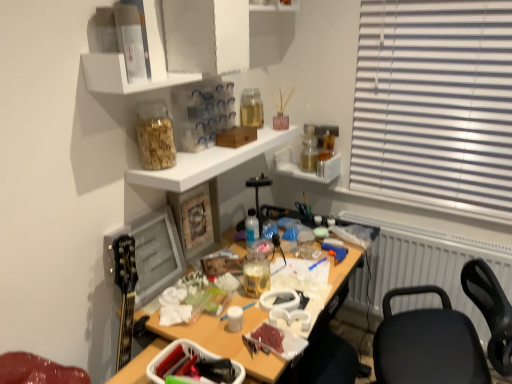
Question: Is white glossy shelf at upper center, which is the second shelf in bottom-to-top order, not within clear plastic container at upper center, arranged as the first shelf when viewed from the top?

Choices:
 (A) no
 (B) yes

Answer: (B)

Question: From a real-world perspective, is white glossy shelf at upper center, the 3th shelf when ordered from top to bottom, located higher than clear plastic container at upper center, arranged as the first shelf when viewed from the top?

Choices:
 (A) no
 (B) yes

Answer: (A)

Question: Is white glossy shelf at upper center, the 3th shelf when ordered from top to bottom, bigger than clear plastic container at upper center, arranged as the first shelf when viewed from the top?

Choices:
 (A) no
 (B) yes

Answer: (B)

Question: Can you confirm if white glossy shelf at upper center, the 3th shelf when ordered from top to bottom, is wider than clear plastic container at upper center, arranged as the first shelf when viewed from the top?

Choices:
 (A) yes
 (B) no

Answer: (A)

Question: Can you confirm if white glossy shelf at upper center, the 3th shelf when ordered from top to bottom, is thinner than clear plastic container at upper center, the 4th shelf from the bottom?

Choices:
 (A) yes
 (B) no

Answer: (B)

Question: From a real-world perspective, is white plastic radiator at right positioned above or below clear plastic container at upper center, the 4th shelf from the bottom?

Choices:
 (A) above
 (B) below

Answer: (B)

Question: From the image's perspective, is white plastic radiator at right above or below clear plastic container at upper center, the 4th shelf from the bottom?

Choices:
 (A) below
 (B) above

Answer: (A)

Question: Considering the positions of white plastic radiator at right and clear plastic container at upper center, arranged as the first shelf when viewed from the top, in the image, is white plastic radiator at right taller or shorter than clear plastic container at upper center, arranged as the first shelf when viewed from the top,?

Choices:
 (A) tall
 (B) short

Answer: (A)

Question: In the image, is white plastic radiator at right on the left side or the right side of clear plastic container at upper center, the 4th shelf from the bottom?

Choices:
 (A) right
 (B) left

Answer: (A)

Question: In the image, is translucent glass jar at upper center, which is counted as the first bottle, starting from the front, on the left side or the right side of clear plastic container at upper center, the 4th shelf from the bottom?

Choices:
 (A) left
 (B) right

Answer: (A)

Question: Does point (145, 137) appear closer or farther from the camera than point (289, 9)?

Choices:
 (A) closer
 (B) farther

Answer: (A)

Question: In terms of width, does translucent glass jar at upper center, the 4th bottle positioned from the right, look wider or thinner when compared to clear plastic container at upper center, arranged as the first shelf when viewed from the top?

Choices:
 (A) thin
 (B) wide

Answer: (A)

Question: From the image's perspective, relative to clear plastic container at upper center, arranged as the first shelf when viewed from the top, is translucent glass jar at upper center, which is the third bottle in top-to-bottom order, above or below?

Choices:
 (A) below
 (B) above

Answer: (A)

Question: Based on their sizes in the image, would you say translucent glass jar at upper right, the third bottle positioned from the bottom, is bigger or smaller than clear plastic container at upper center, arranged as the first shelf when viewed from the top?

Choices:
 (A) small
 (B) big

Answer: (A)

Question: In terms of height, does translucent glass jar at upper right, which is the 1th bottle in right-to-left order, look taller or shorter compared to clear plastic container at upper center, arranged as the first shelf when viewed from the top?

Choices:
 (A) tall
 (B) short

Answer: (B)